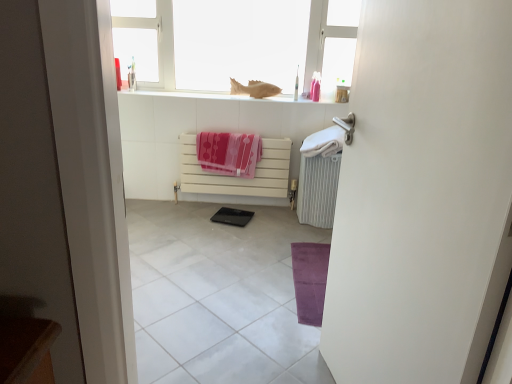
I want to click on free spot behind black glossy pad at center, so click(232, 202).